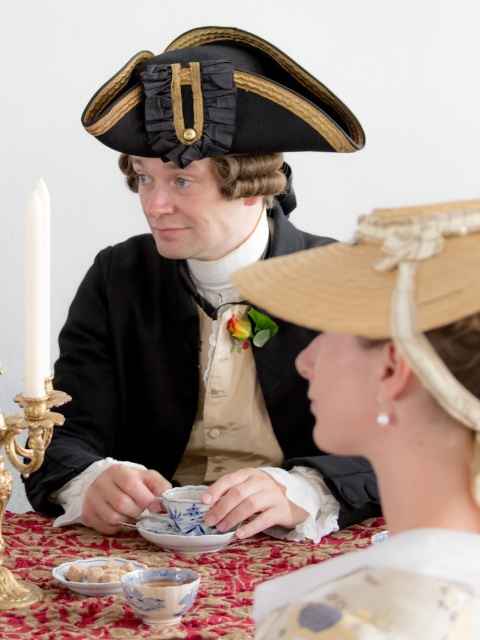
Which is below, white glossy dumplings at lower left or white porcelain bowl at lower center?

white glossy dumplings at lower left is below.

Who is taller, white glossy dumplings at lower left or white porcelain bowl at lower center?

white glossy dumplings at lower left

Describe the element at coordinates (98, 572) in the screenshot. I see `white glossy dumplings at lower left` at that location.

The height and width of the screenshot is (640, 480). I want to click on white glossy dumplings at lower left, so click(98, 572).

Can you confirm if natural straw hat at center is thinner than white porcelain bowl at lower center?

In fact, natural straw hat at center might be wider than white porcelain bowl at lower center.

Is natural straw hat at center wider than white porcelain bowl at lower center?

Indeed, natural straw hat at center has a greater width compared to white porcelain bowl at lower center.

Is point (451, 209) behind point (192, 577)?

No, it is not.

I want to click on natural straw hat at center, so click(386, 289).

Can you confirm if black straw hat at upper center is positioned below gold ornate candlestick at left?

Actually, black straw hat at upper center is above gold ornate candlestick at left.

Which is in front, point (216, 148) or point (40, 205)?

Point (40, 205) is in front.

Find the location of a particular element. black straw hat at upper center is located at coordinates (217, 100).

You are a GUI agent. You are given a task and a screenshot of the screen. Output one action in this format:
    pyautogui.click(x=<x>, y=<y>)
    Task: Click on the black straw hat at upper center
    Image resolution: width=480 pixels, height=640 pixels.
    Given the screenshot: What is the action you would take?
    pyautogui.click(x=217, y=100)